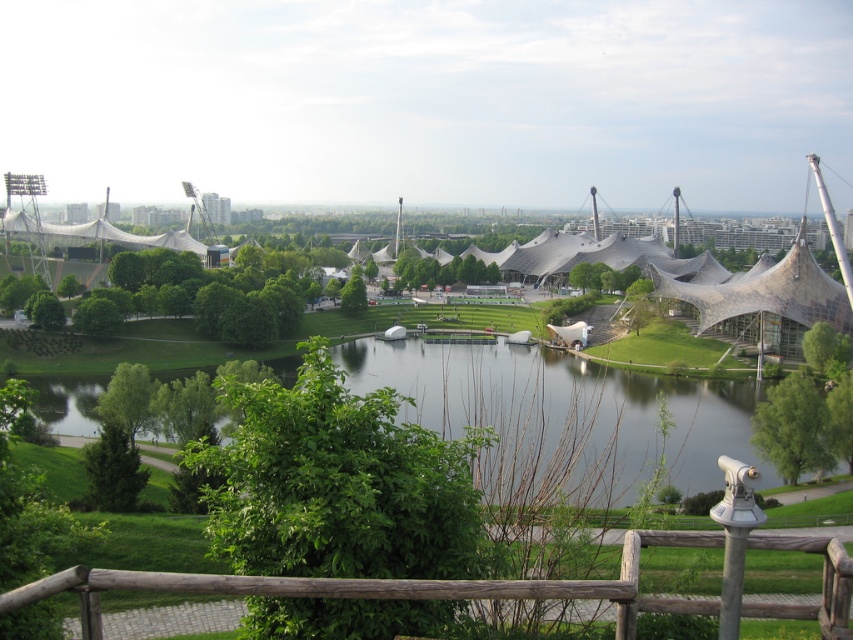
Is textured fabric dome at center positioned behind brown wooden rail at lower center?

Yes, it is behind brown wooden rail at lower center.

Is point (633, 630) positioned after point (10, 592)?

Yes, point (633, 630) is farther from viewer.

The width and height of the screenshot is (853, 640). Identify the location of textured fabric dome at center. (502, 584).

Which is behind, point (529, 385) or point (757, 515)?

Positioned behind is point (529, 385).

Does green grassy river at center have a lesser width compared to textured fabric dome at center?

In fact, green grassy river at center might be wider than textured fabric dome at center.

Locate an element on the screen. The width and height of the screenshot is (853, 640). green grassy river at center is located at coordinates (563, 413).

Looking at this image, which of these two, green grassy river at center or brown wooden rail at lower center, stands shorter?

brown wooden rail at lower center is shorter.

How far apart are green grassy river at center and brown wooden rail at lower center?

green grassy river at center is 49.15 meters away from brown wooden rail at lower center.

Does point (364, 342) lie behind point (825, 618)?

Yes.

Identify the location of green grassy river at center. (563, 413).